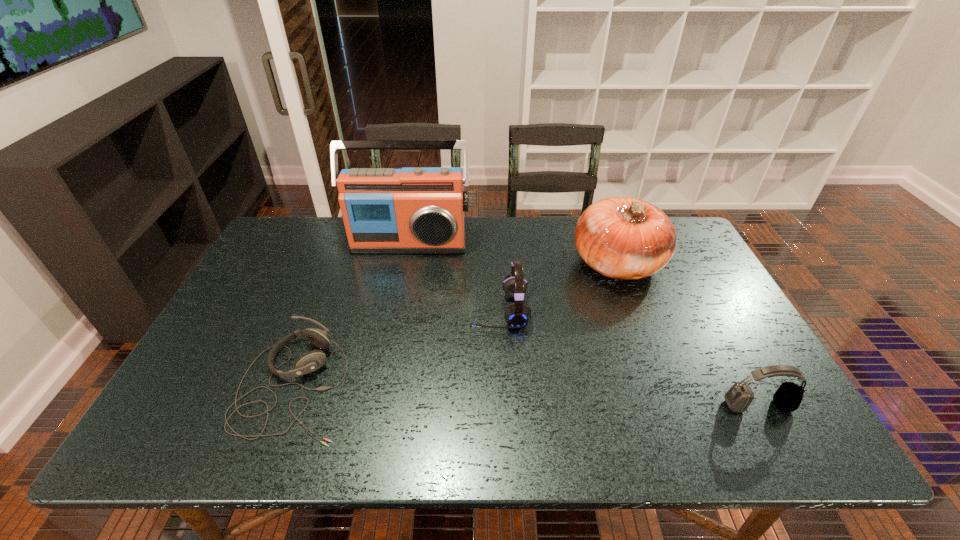
At what (x,y) coordinates should I click in order to perform the action: click on vacant area between the leftmost headset and the third object from right to left. Please return your answer as a coordinate pair (x, y). The image size is (960, 540). Looking at the image, I should click on (396, 348).

The height and width of the screenshot is (540, 960). In order to click on vacant space that's between the radio receiver and the third object from right to left in this screenshot , I will do `click(454, 277)`.

At what (x,y) coordinates should I click in order to perform the action: click on empty space between the third object from left to right and the radio receiver. Please return your answer as a coordinate pair (x, y). This screenshot has width=960, height=540. Looking at the image, I should click on (454, 277).

Where is `free space between the second tallest object and the shortest headset`? The width and height of the screenshot is (960, 540). free space between the second tallest object and the shortest headset is located at coordinates (456, 324).

Where is `free spot between the shortest object and the tallest object`? The width and height of the screenshot is (960, 540). free spot between the shortest object and the tallest object is located at coordinates (351, 314).

What are the coordinates of `unoccupied area between the farthest headset and the radio receiver` in the screenshot? It's located at (454, 277).

At what (x,y) coordinates should I click in order to perform the action: click on vacant area that lies between the pumpkin and the second headset from right to left. Please return your answer as a coordinate pair (x, y). Looking at the image, I should click on (559, 287).

Locate an element on the screen. This screenshot has height=540, width=960. unoccupied position between the fourth tallest object and the shortest object is located at coordinates pyautogui.click(x=526, y=395).

Where is `object that is the closest to the leftmost headset`? object that is the closest to the leftmost headset is located at coordinates (517, 314).

At what (x,y) coordinates should I click in order to perform the action: click on object that is the second closest one to the radio receiver. Please return your answer as a coordinate pair (x, y). Looking at the image, I should click on (624, 238).